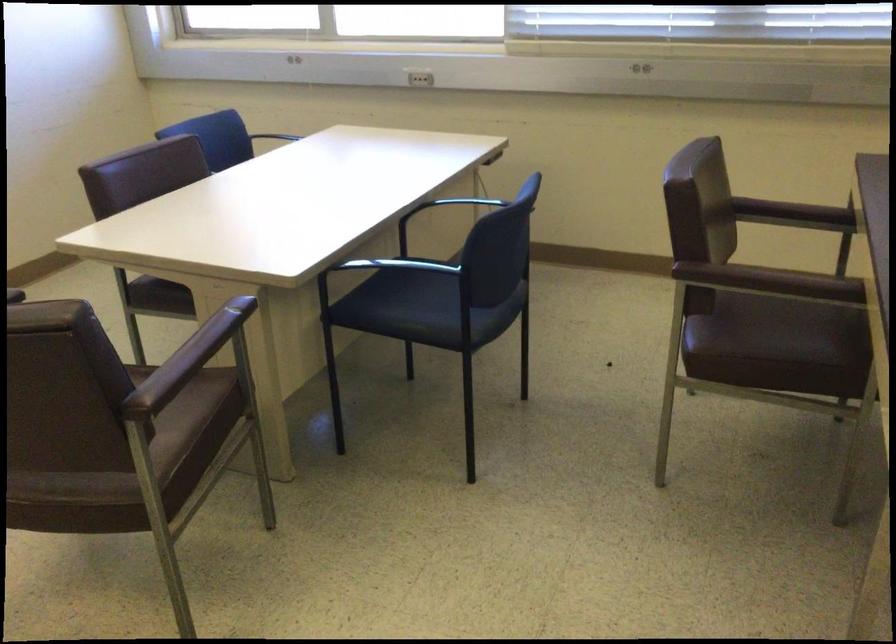
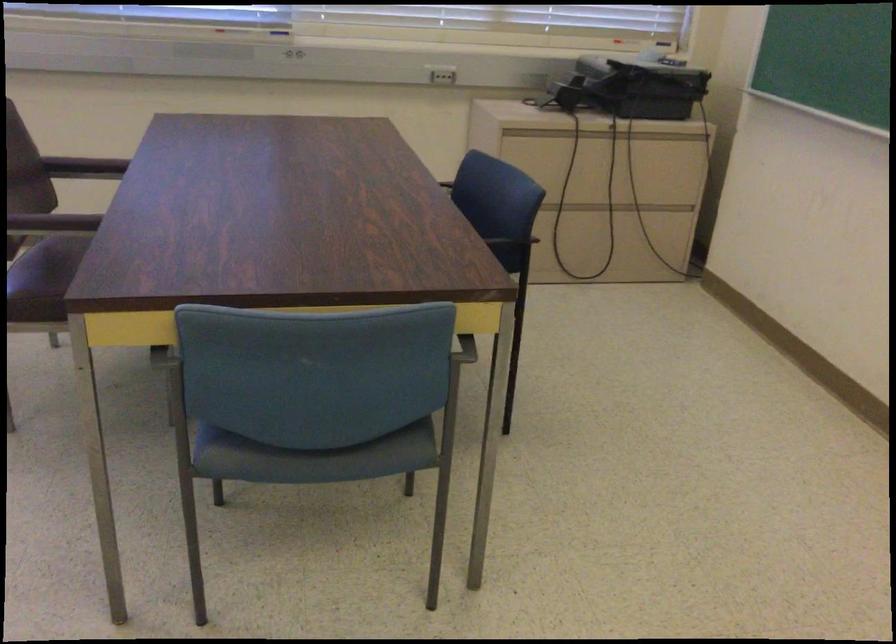
Question: How did the camera likely rotate?

Choices:
 (A) Left
 (B) Right
 (C) Up
 (D) Down

Answer: (B)